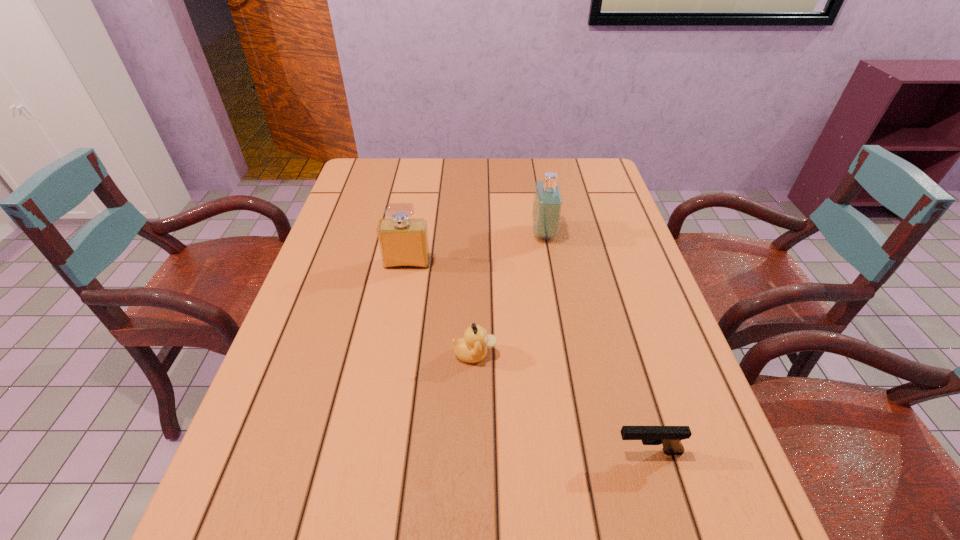
Where is `blank region between the nearer perfume and the duckling`? Image resolution: width=960 pixels, height=540 pixels. blank region between the nearer perfume and the duckling is located at coordinates (441, 309).

In order to click on empty space that is in between the left perfume and the shortest object in this screenshot , I will do `click(527, 357)`.

This screenshot has height=540, width=960. Find the location of `free area in between the second nearest object and the rightmost object`. free area in between the second nearest object and the rightmost object is located at coordinates (562, 403).

Select which object is the second closest to the second farthest object. Please provide its 2D coordinates. Your answer should be formatted as a tuple, i.e. [(x, y)], where the tuple contains the x and y coordinates of a point satisfying the conditions above.

[(547, 204)]

Image resolution: width=960 pixels, height=540 pixels. Find the location of `object identified as the third closest to the farther perfume`. object identified as the third closest to the farther perfume is located at coordinates (670, 437).

Identify the location of free space that satisfies the following two spatial constraints: 1. on the front label of the third object from left to right; 2. on the front-facing side of the nearer perfume. The width and height of the screenshot is (960, 540). (549, 264).